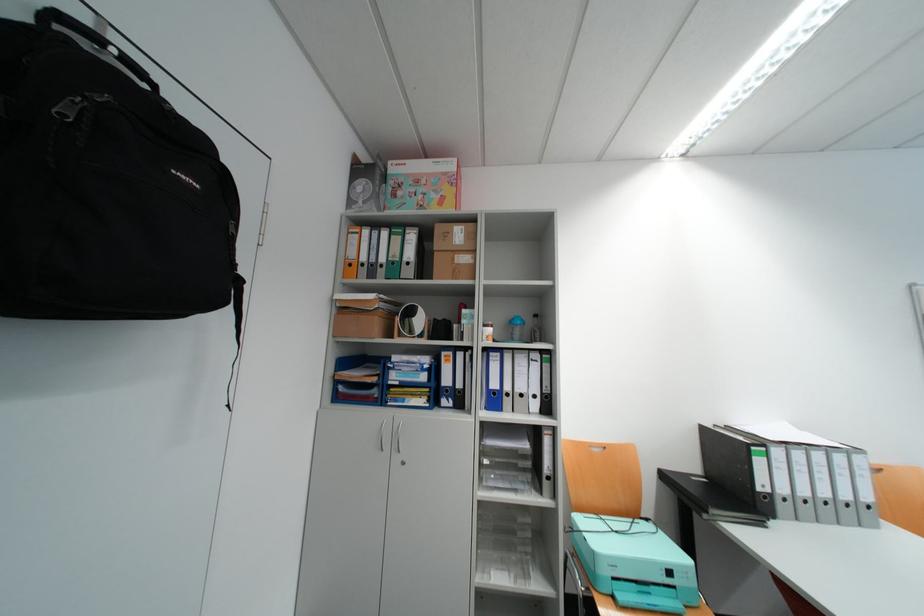
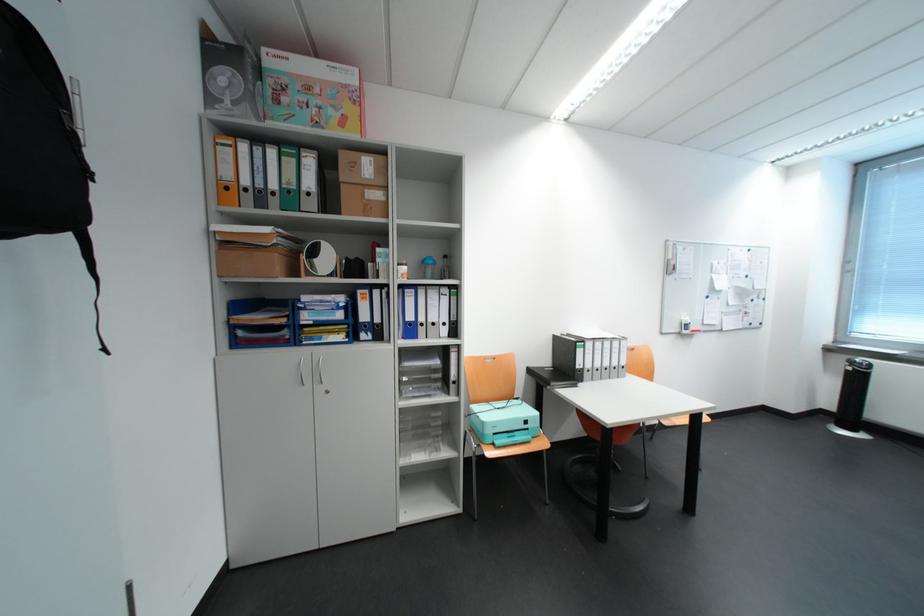
Where in the second image is the point corresponding to point 830,458 from the first image?

(618, 345)